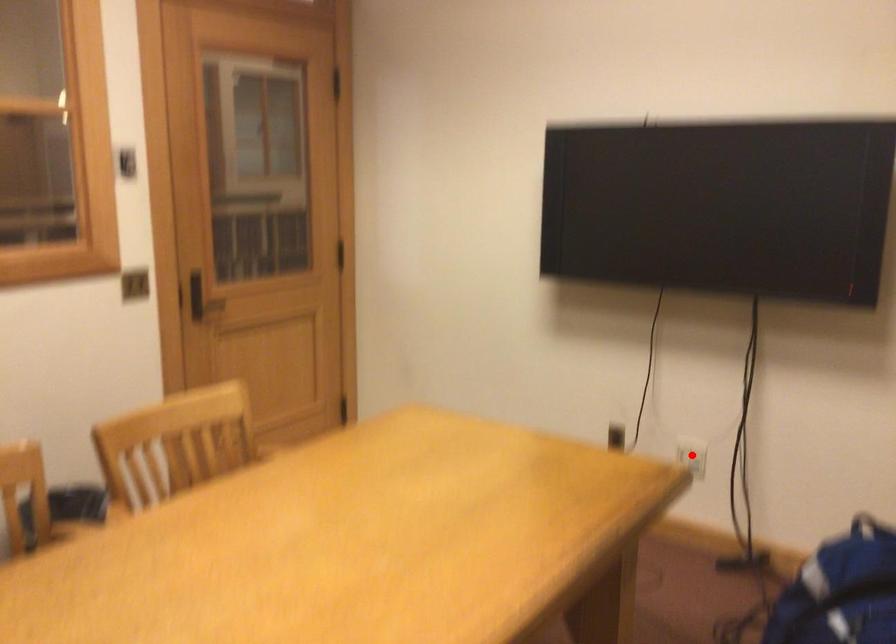
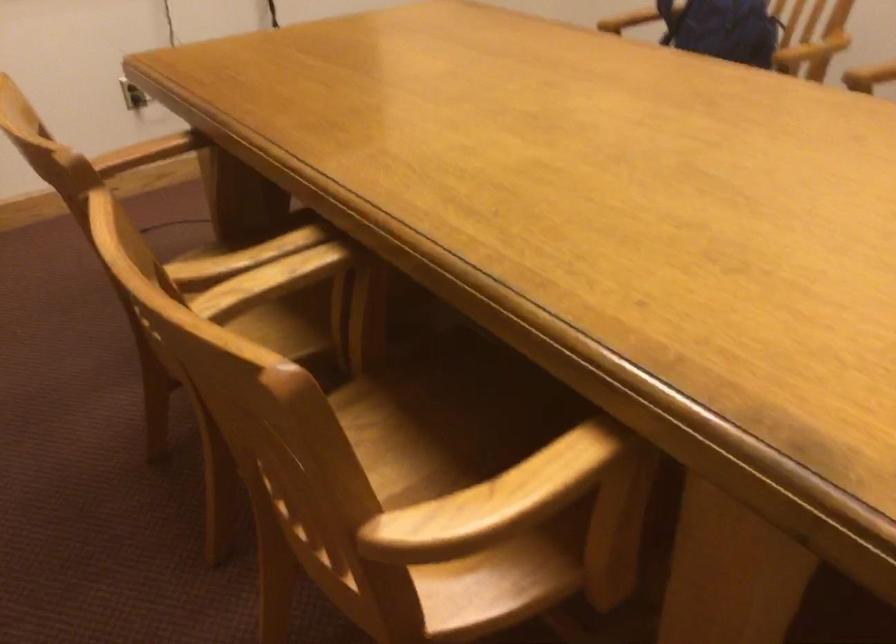
Question: I am providing you with two images of the same scene from different viewpoints. A red point is marked on the first image. Can you still see the location of the red point in image 2?

Choices:
 (A) Yes
 (B) No

Answer: (B)